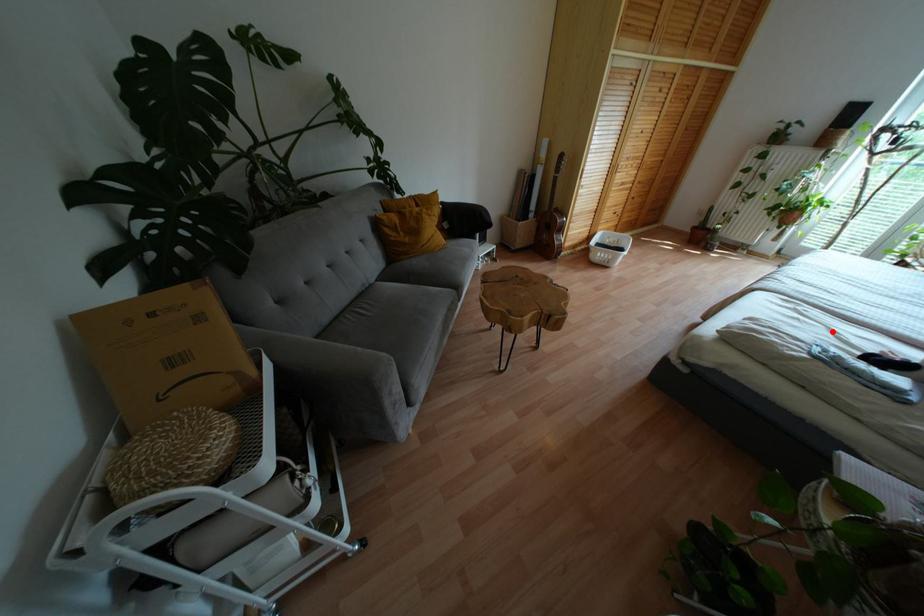
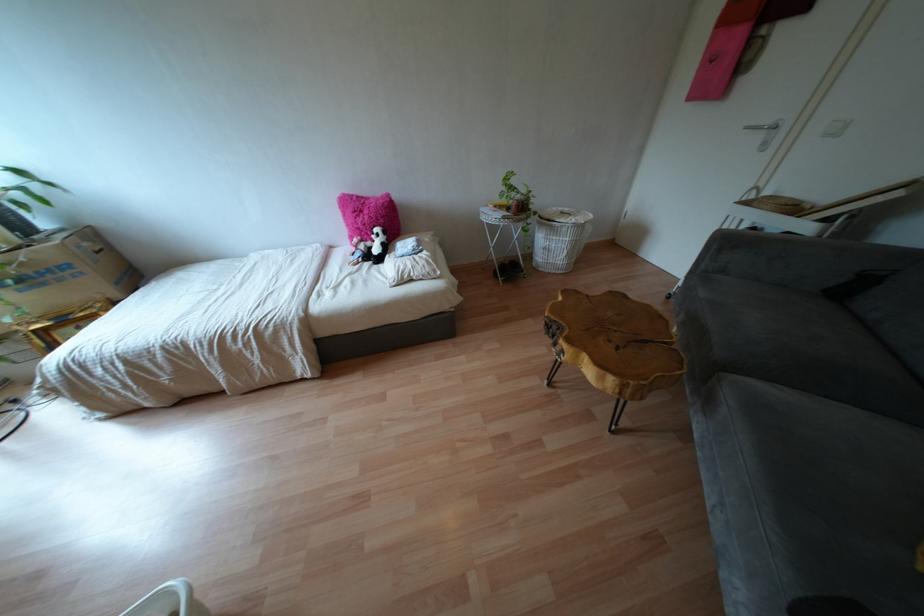
Locate, in the second image, the point that corresponds to the highlighted location in the first image.

(349, 274)